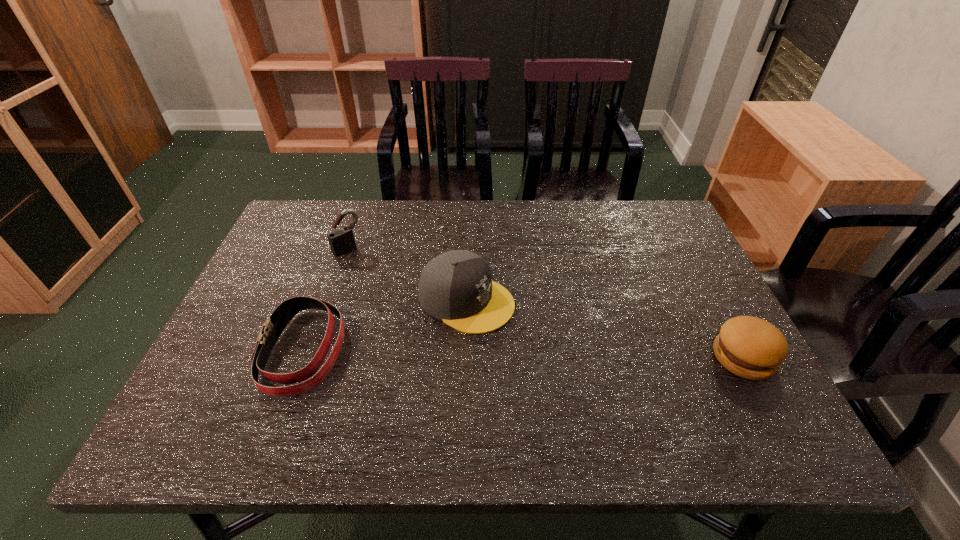
Identify the location of free space on the desktop that is between the dog collar and the rightmost object and is positioned with the keyhole on the front of the farthest object. This screenshot has width=960, height=540. (457, 353).

I want to click on vacant space on the desktop that is between the dog collar and the rightmost object and is positioned on the front-facing side of the cap, so click(578, 354).